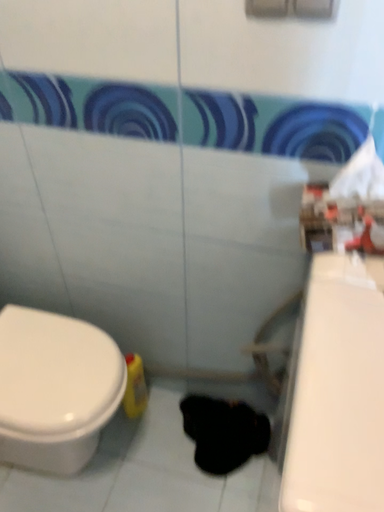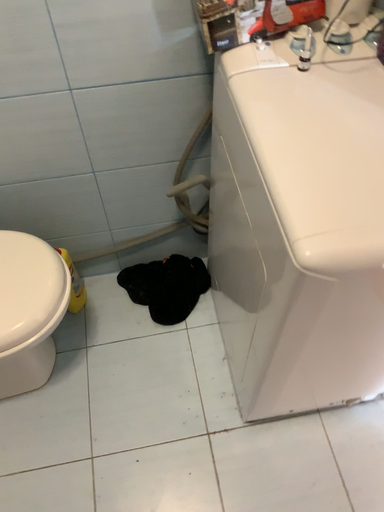
Question: How did the camera likely rotate when shooting the video?

Choices:
 (A) rotated left
 (B) rotated right

Answer: (B)